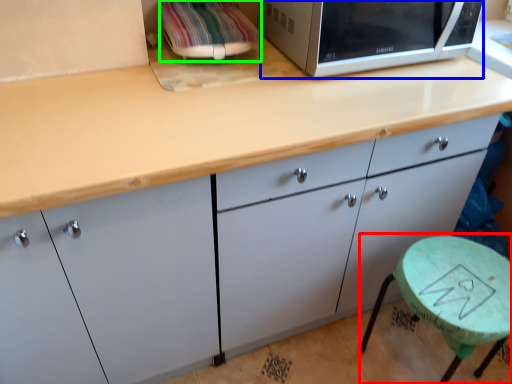
Question: Considering the real-world distances, which object is closest to round table (highlighted by a red box)? microwave oven (highlighted by a blue box) or appliance (highlighted by a green box).

Choices:
 (A) microwave oven
 (B) appliance

Answer: (A)